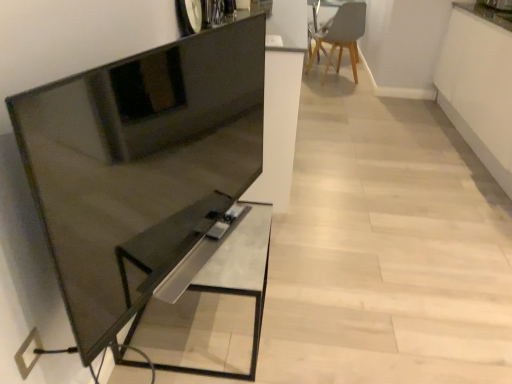
Question: From the image's perspective, relative to metallic silver table at center, is matte gray chair at upper right above or below?

Choices:
 (A) above
 (B) below

Answer: (A)

Question: Is point (347, 4) closer or farther from the camera than point (254, 352)?

Choices:
 (A) farther
 (B) closer

Answer: (A)

Question: Based on their relative distances, which object is farther from the metallic silver table at center?

Choices:
 (A) matte black tv stand at left
 (B) matte gray chair at upper right

Answer: (B)

Question: Considering the real-world distances, which object is closest to the matte black tv stand at left?

Choices:
 (A) matte gray chair at upper right
 (B) metallic silver table at center

Answer: (B)